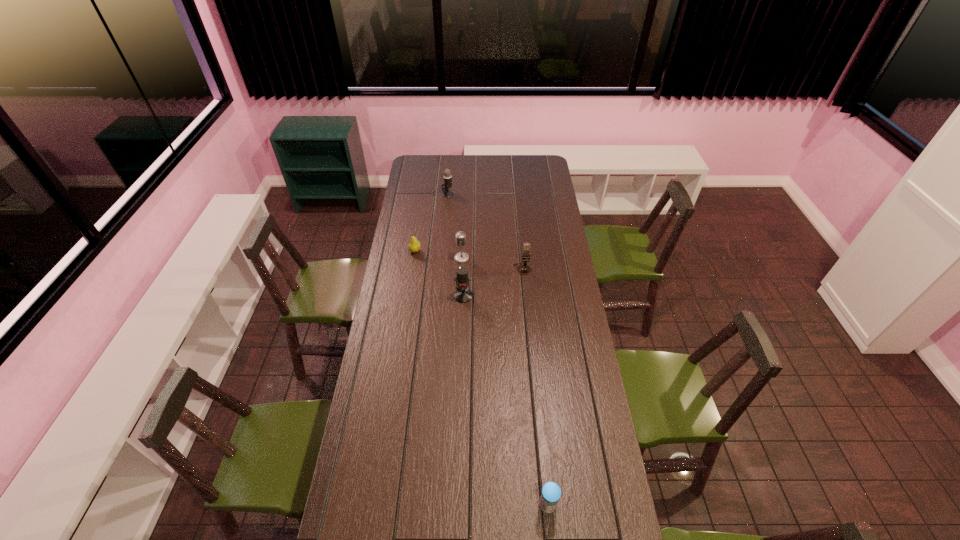
What are the coordinates of `the farthest object` in the screenshot? It's located at (447, 176).

This screenshot has height=540, width=960. In order to click on the farthest microphone in this screenshot , I will do `click(447, 176)`.

Locate an element on the screen. Image resolution: width=960 pixels, height=540 pixels. the nearest microphone is located at coordinates (463, 294).

This screenshot has width=960, height=540. I want to click on the rightmost microphone, so click(524, 269).

Where is `the leftmost object`? Image resolution: width=960 pixels, height=540 pixels. the leftmost object is located at coordinates (414, 246).

Where is `the nearest object`? the nearest object is located at coordinates (551, 492).

This screenshot has height=540, width=960. Identify the location of free spot located 0.060m on the back of the second object from left to right. (448, 185).

Find the location of a particular element. The height and width of the screenshot is (540, 960). free spot located on the side of the second nearest object with the red ring is located at coordinates tap(463, 325).

Image resolution: width=960 pixels, height=540 pixels. I want to click on free space located on the front-facing side of the rightmost microphone, so click(526, 310).

Locate an element on the screen. The image size is (960, 540). vacant space situated 0.390m on the front of the pear is located at coordinates (405, 314).